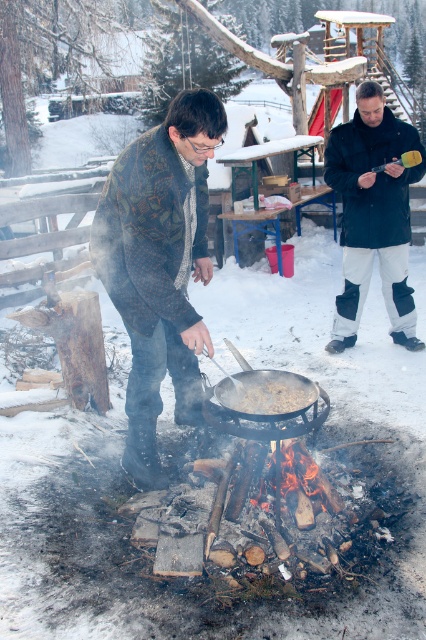
Which of these two, knitted sweater at center or wooden picnic table at center, stands taller?

With more height is wooden picnic table at center.

Is knitted sweater at center shorter than wooden picnic table at center?

Yes, knitted sweater at center is shorter than wooden picnic table at center.

Which is behind, point (111, 289) or point (265, 221)?

The point (265, 221) is more distant.

Find the location of a particular element. knitted sweater at center is located at coordinates (160, 266).

I want to click on wooden picnic table at center, so click(x=258, y=186).

Does wooden picnic table at center have a greater width compared to brown matte pan at center?

Yes.

The width and height of the screenshot is (426, 640). I want to click on wooden picnic table at center, so click(x=258, y=186).

Between point (186, 179) and point (244, 403), which one is positioned behind?

The point (244, 403) is more distant.

Who is taller, knitted sweater at center or brown matte pan at center?

With more height is knitted sweater at center.

This screenshot has height=640, width=426. In order to click on knitted sweater at center in this screenshot , I will do `click(160, 266)`.